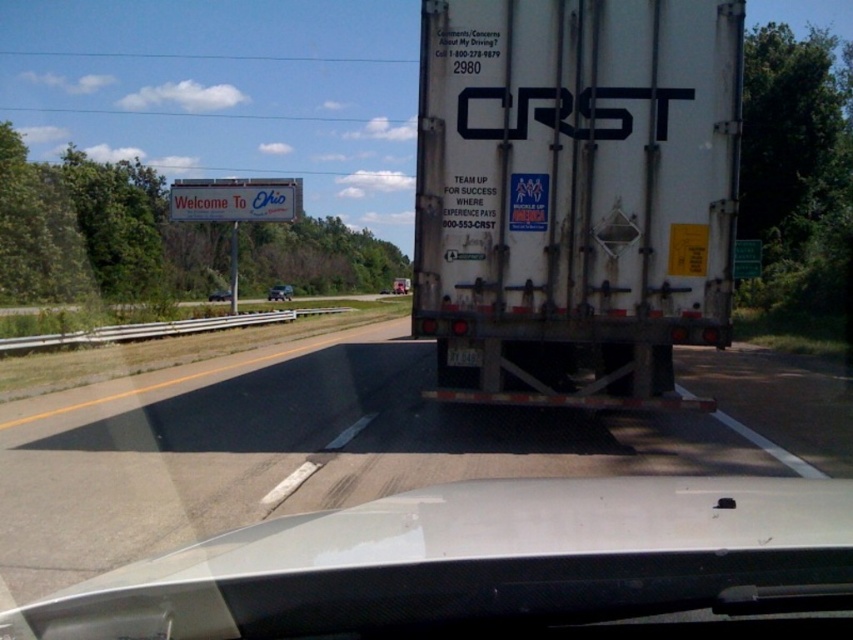
Who is lower down, white matte trailer truck at center or matte black car at center?

white matte trailer truck at center

Which of these two, white matte trailer truck at center or matte black car at center, stands shorter?

matte black car at center is shorter.

Is point (618, 259) farther from viewer compared to point (219, 292)?

No, it is in front of (219, 292).

The width and height of the screenshot is (853, 640). What are the coordinates of `white matte trailer truck at center` in the screenshot? It's located at (575, 195).

In the scene shown: Is white matte train car at center above metallic silver sedan at center?

No.

Does white matte train car at center have a greater height compared to metallic silver sedan at center?

Incorrect, white matte train car at center's height is not larger of metallic silver sedan at center's.

Is point (750, 560) closer to viewer compared to point (283, 285)?

Yes, it is in front of point (283, 285).

Find the location of `white matte train car at center`. white matte train car at center is located at coordinates (480, 561).

Does white glossy truck at center appear on the right side of white matte train car at center?

Indeed, white glossy truck at center is positioned on the right side of white matte train car at center.

Measure the distance between white glossy truck at center and camera.

white glossy truck at center and camera are 3.88 meters apart.

Is point (755, 369) positioned before point (625, 545)?

No, it is behind (625, 545).

At what (x,y) coordinates should I click in order to perform the action: click on white glossy truck at center. Please return your answer as a coordinate pair (x, y). Image resolution: width=853 pixels, height=640 pixels. Looking at the image, I should click on (345, 444).